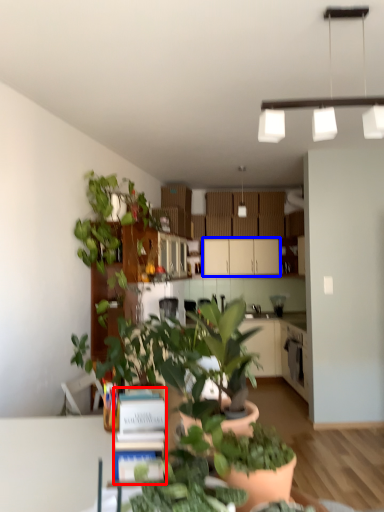
Question: Which of the following is the closest to the observer, book (highlighted by a red box) or cabinetry (highlighted by a blue box)?

Choices:
 (A) book
 (B) cabinetry

Answer: (A)